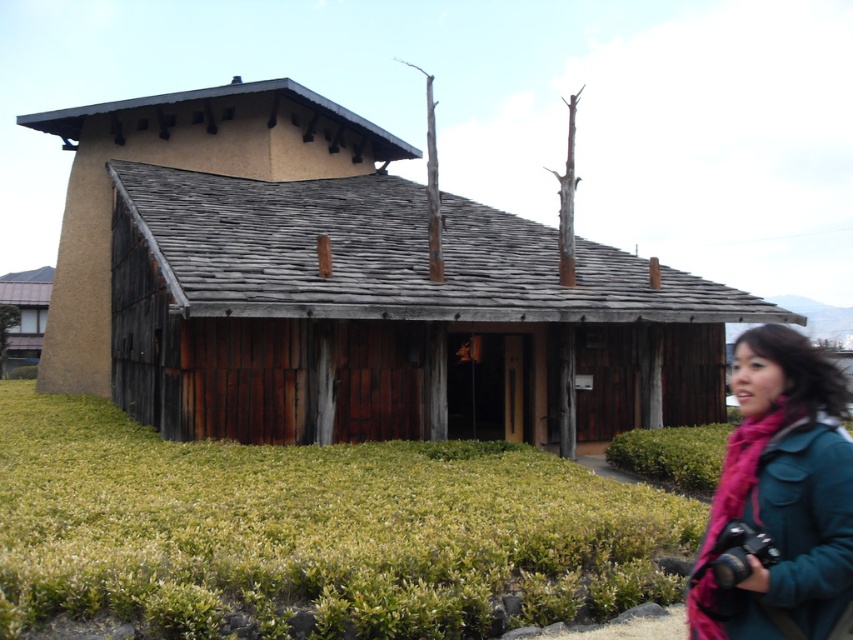
Question: Based on their relative distances, which object is nearer to the matte brown wooden hut at lower left?

Choices:
 (A) brown wooden hut at center
 (B) teal fabric scarf at lower right

Answer: (A)

Question: Which object appears closest to the camera in this image?

Choices:
 (A) brown wooden hut at center
 (B) matte brown wooden hut at lower left

Answer: (A)

Question: Can you confirm if brown wooden hut at center is positioned to the left of matte brown wooden hut at lower left?

Choices:
 (A) no
 (B) yes

Answer: (A)

Question: Where is brown wooden hut at center located in relation to matte brown wooden hut at lower left in the image?

Choices:
 (A) above
 (B) below

Answer: (B)

Question: Which object appears farthest from the camera in this image?

Choices:
 (A) teal fabric scarf at lower right
 (B) brown wooden hut at center
 (C) matte brown wooden hut at lower left

Answer: (C)

Question: Can you confirm if teal fabric scarf at lower right is smaller than matte brown wooden hut at lower left?

Choices:
 (A) yes
 (B) no

Answer: (A)